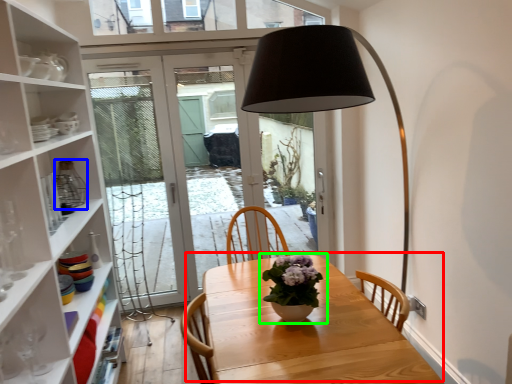
Question: Estimate the real-world distances between objects in this image. Which object is farther from table (highlighted by a red box), glass vase (highlighted by a blue box) or houseplant (highlighted by a green box)?

Choices:
 (A) glass vase
 (B) houseplant

Answer: (A)